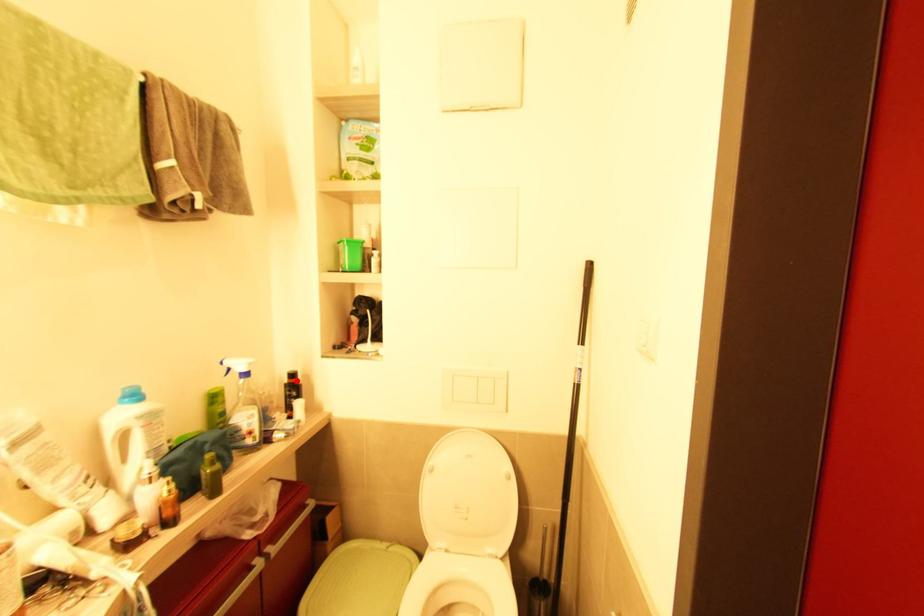
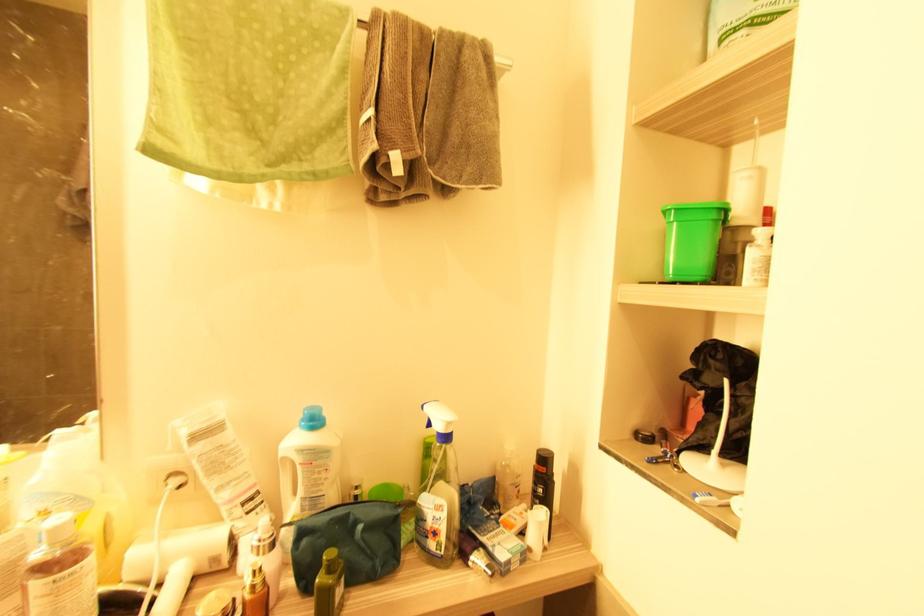
In the second image, find the point that corresponds to the highlighted location in the first image.

(545, 469)